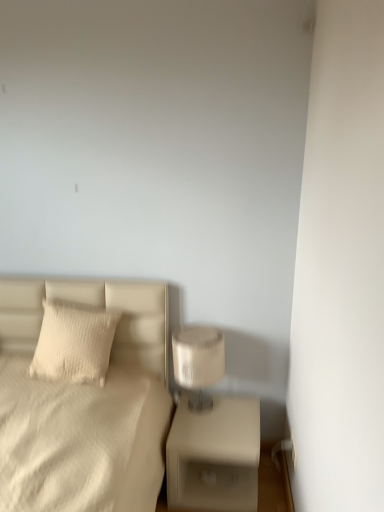
Question: Is beige matte nightstand at lower right placed right next to white textured pillow at left?

Choices:
 (A) yes
 (B) no

Answer: (B)

Question: Does beige matte nightstand at lower right have a greater width compared to white textured pillow at left?

Choices:
 (A) yes
 (B) no

Answer: (A)

Question: Does beige matte nightstand at lower right appear on the right side of white textured pillow at left?

Choices:
 (A) no
 (B) yes

Answer: (B)

Question: From a real-world perspective, is beige matte nightstand at lower right under white textured pillow at left?

Choices:
 (A) yes
 (B) no

Answer: (A)

Question: Does beige matte nightstand at lower right have a greater height compared to white textured pillow at left?

Choices:
 (A) no
 (B) yes

Answer: (B)

Question: Do you think satin beige lampshade at right is within white textured pillow at left, or outside of it?

Choices:
 (A) outside
 (B) inside

Answer: (A)

Question: From the image's perspective, is satin beige lampshade at right located above or below white textured pillow at left?

Choices:
 (A) below
 (B) above

Answer: (A)

Question: In the image, is satin beige lampshade at right on the left side or the right side of white textured pillow at left?

Choices:
 (A) left
 (B) right

Answer: (B)

Question: Looking at their shapes, would you say satin beige lampshade at right is wider or thinner than white textured pillow at left?

Choices:
 (A) wide
 (B) thin

Answer: (A)

Question: Is beige matte nightstand at lower right wider or thinner than satin beige lampshade at right?

Choices:
 (A) thin
 (B) wide

Answer: (B)

Question: Is beige matte nightstand at lower right taller or shorter than satin beige lampshade at right?

Choices:
 (A) short
 (B) tall

Answer: (A)

Question: Does point (221, 451) appear closer or farther from the camera than point (210, 356)?

Choices:
 (A) closer
 (B) farther

Answer: (A)

Question: In terms of size, does beige matte nightstand at lower right appear bigger or smaller than satin beige lampshade at right?

Choices:
 (A) big
 (B) small

Answer: (A)

Question: Is white textured pillow at left spatially inside beige matte nightstand at lower right, or outside of it?

Choices:
 (A) outside
 (B) inside

Answer: (A)

Question: Is white textured pillow at left bigger or smaller than beige matte nightstand at lower right?

Choices:
 (A) small
 (B) big

Answer: (A)